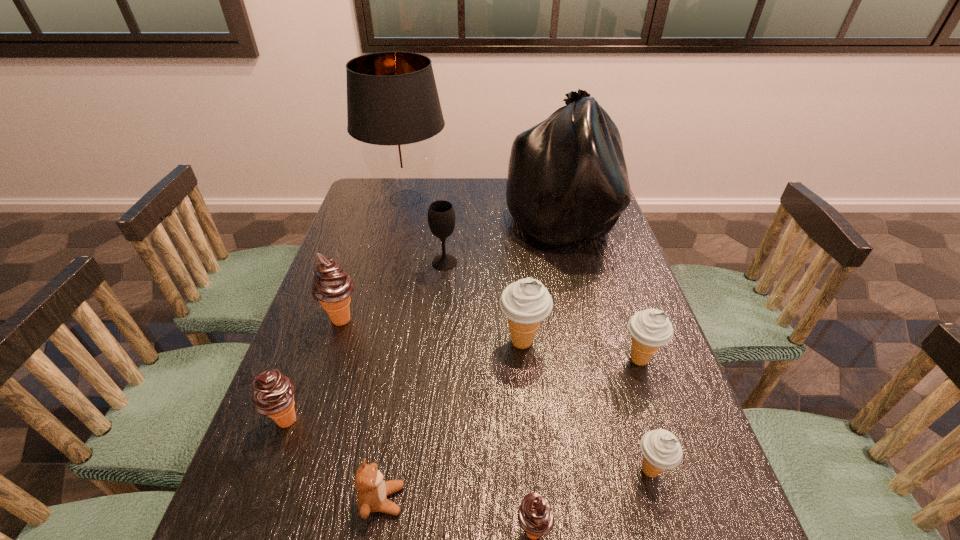
Where is `gray lampshade`? The width and height of the screenshot is (960, 540). gray lampshade is located at coordinates (393, 106).

This screenshot has height=540, width=960. I want to click on plastic bag, so click(567, 180).

You are a GUI agent. You are given a task and a screenshot of the screen. Output one action in this format:
    pyautogui.click(x=<x>, y=<y>)
    Task: Click on the leftmost beige icecream
    
    Given the screenshot: What is the action you would take?
    pyautogui.click(x=526, y=302)

Find the location of a particular element. This screenshot has width=960, height=540. the biggest chocolate icecream is located at coordinates (331, 286).

Locate an element on the screen. Image resolution: width=960 pixels, height=540 pixels. wineglass is located at coordinates (441, 216).

Where is `the second biggest beige icecream`? the second biggest beige icecream is located at coordinates (650, 329).

You are a GUI agent. You are given a task and a screenshot of the screen. Output one action in this format:
    pyautogui.click(x=<x>, y=<y>)
    Task: Click on the third nearest icecream
    
    Given the screenshot: What is the action you would take?
    pyautogui.click(x=273, y=395)

The height and width of the screenshot is (540, 960). What are the coordinates of `the second nearest chocolate icecream` in the screenshot? It's located at (273, 395).

This screenshot has width=960, height=540. What are the coordinates of `the smallest beige icecream` in the screenshot? It's located at (661, 450).

Find the location of a particular element. The image size is (960, 540). the nearest beige icecream is located at coordinates (661, 450).